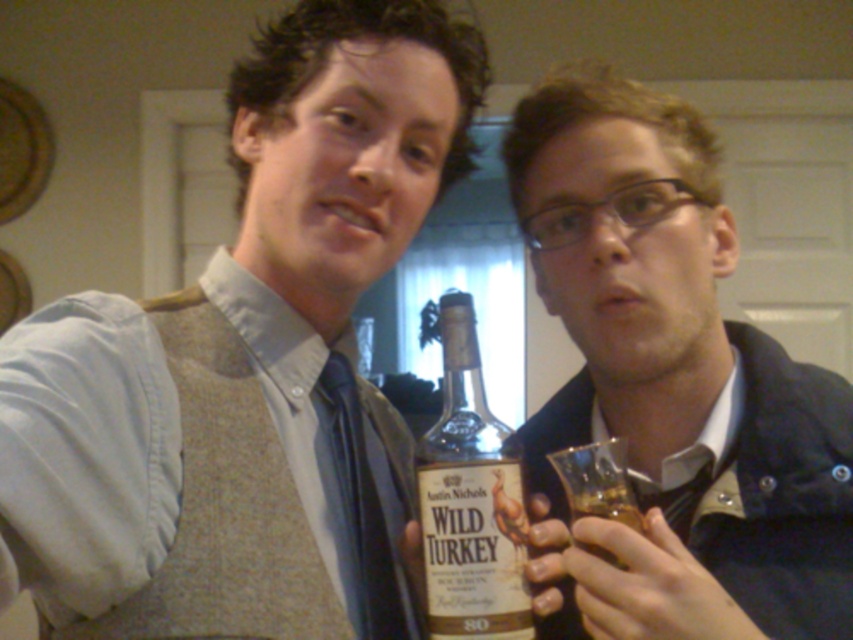
Question: Is matte brown vest at center positioned at the back of matte black jacket at center?

Choices:
 (A) no
 (B) yes

Answer: (A)

Question: Considering the relative positions of matte glass bottle at center and translucent amber liquid at lower right in the image provided, where is matte glass bottle at center located with respect to translucent amber liquid at lower right?

Choices:
 (A) above
 (B) below

Answer: (A)

Question: Which point is closer to the camera?

Choices:
 (A) coord(460,301)
 (B) coord(384,186)
 (C) coord(386,588)

Answer: (A)

Question: Which point is closer to the camera?

Choices:
 (A) translucent amber liquid at lower right
 (B) matte brown vest at center
 (C) black silk tie at center
 (D) matte glass bottle at center

Answer: (B)

Question: Which object is closer to the camera taking this photo?

Choices:
 (A) matte brown vest at center
 (B) translucent amber liquid at lower right

Answer: (A)

Question: Is matte brown vest at center positioned at the back of matte glass bottle at center?

Choices:
 (A) yes
 (B) no

Answer: (B)